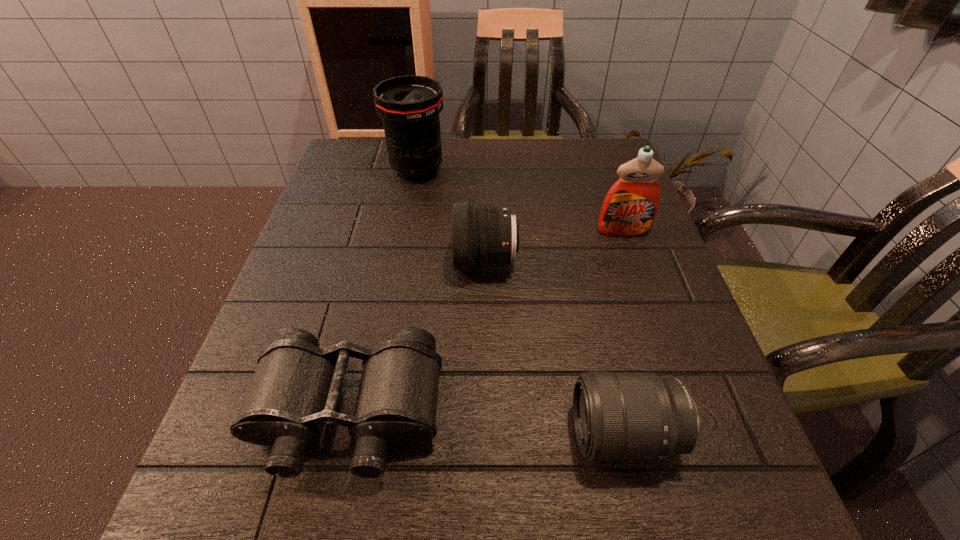
Locate an element on the screen. This screenshot has width=960, height=540. telephoto lens present at the right edge is located at coordinates (618, 416).

This screenshot has width=960, height=540. In order to click on object at the far left corner in this screenshot , I will do `click(409, 106)`.

The width and height of the screenshot is (960, 540). In order to click on object at the near left corner in this screenshot , I will do `click(295, 389)`.

Where is `free location at the far edge of the desktop`? This screenshot has width=960, height=540. free location at the far edge of the desktop is located at coordinates (533, 176).

Where is `vacant region at the near edge`? vacant region at the near edge is located at coordinates (592, 504).

The image size is (960, 540). In order to click on free space at the left edge of the desktop in this screenshot , I will do pos(372,197).

Locate an element on the screen. Image resolution: width=960 pixels, height=540 pixels. free region at the right edge of the desktop is located at coordinates (658, 302).

In the image, there is a desktop. Identify the location of vacant space at the far left corner. (348, 161).

In the image, there is a desktop. Where is `vacant region at the far right corner`? The image size is (960, 540). vacant region at the far right corner is located at coordinates (564, 160).

Image resolution: width=960 pixels, height=540 pixels. What are the coordinates of `free spot between the second farthest object and the third nearest object` in the screenshot? It's located at (554, 246).